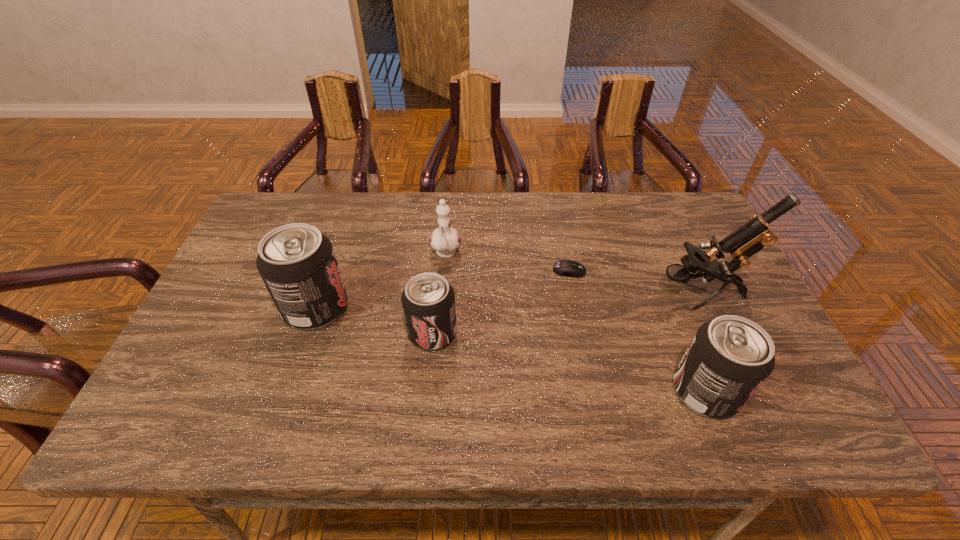
Identify the location of vacant area between the chinaware and the leftmost soda can. Image resolution: width=960 pixels, height=540 pixels. (381, 281).

Locate an element on the screen. This screenshot has width=960, height=540. vacant point located between the shortest soda can and the leftmost object is located at coordinates (374, 320).

Identify the location of vacant space in between the tallest object and the leftmost object. The height and width of the screenshot is (540, 960). (508, 301).

This screenshot has height=540, width=960. I want to click on vacant area between the second soda can from left to right and the microscope, so click(x=566, y=313).

Identify the location of vacant space that's between the leftmost soda can and the shortest soda can. Image resolution: width=960 pixels, height=540 pixels. (374, 320).

Locate which object is the closest to the tallest object. Please provide its 2D coordinates. Your answer should be formatted as a tuple, i.e. [(x, y)], where the tuple contains the x and y coordinates of a point satisfying the conditions above.

[(728, 359)]

Identify the location of object that is the second closest to the leftmost object. (445, 240).

Where is `the closest soda can relative to the leftmost soda can`? the closest soda can relative to the leftmost soda can is located at coordinates (428, 300).

Select which soda can appears as the closest to the second soda can from left to right. Please provide its 2D coordinates. Your answer should be formatted as a tuple, i.e. [(x, y)], where the tuple contains the x and y coordinates of a point satisfying the conditions above.

[(297, 263)]

In order to click on free spot that satisfies the following two spatial constraints: 1. on the back side of the shortest object; 2. on the left side of the leftmost soda can in this screenshot , I will do `click(328, 271)`.